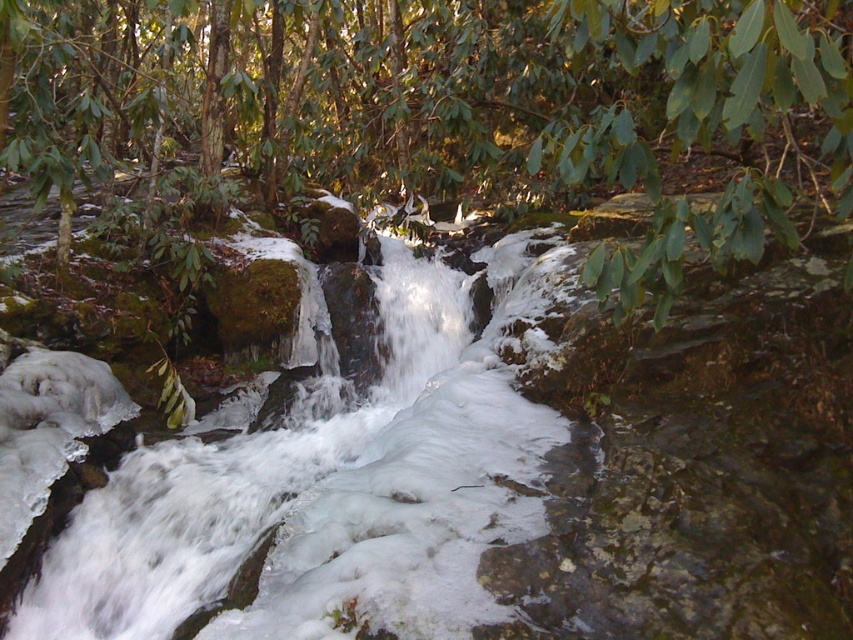
Question: Which object appears closest to the camera in this image?

Choices:
 (A) white frothy water at center
 (B) green leafy tree at center

Answer: (B)

Question: Which object appears farthest from the camera in this image?

Choices:
 (A) white frothy water at center
 (B) green leafy tree at center

Answer: (A)

Question: Is white frothy water at center below green leafy tree at center?

Choices:
 (A) no
 (B) yes

Answer: (B)

Question: Which of the following is the closest to the observer?

Choices:
 (A) (786, 64)
 (B) (537, 374)

Answer: (A)

Question: Can you confirm if white frothy water at center is positioned above green leafy tree at center?

Choices:
 (A) yes
 (B) no

Answer: (B)

Question: Is white frothy water at center above green leafy tree at center?

Choices:
 (A) yes
 (B) no

Answer: (B)